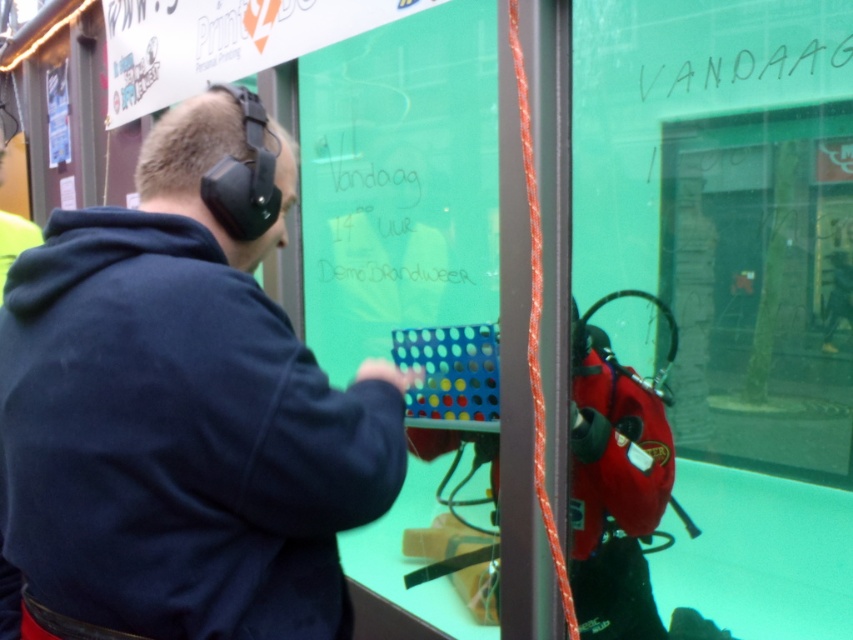
Question: Which point is farther to the camera?

Choices:
 (A) dark blue hoodie at upper left
 (B) black handwritten text at upper right

Answer: (B)

Question: Does dark blue hoodie at upper left appear over black handwritten text at upper right?

Choices:
 (A) no
 (B) yes

Answer: (A)

Question: Which object is closer to the camera taking this photo?

Choices:
 (A) dark blue hoodie at upper left
 (B) black handwritten text at upper right

Answer: (A)

Question: Does dark blue hoodie at upper left appear on the left side of black handwritten text at upper right?

Choices:
 (A) yes
 (B) no

Answer: (A)

Question: Is dark blue hoodie at upper left bigger than black handwritten text at upper right?

Choices:
 (A) no
 (B) yes

Answer: (B)